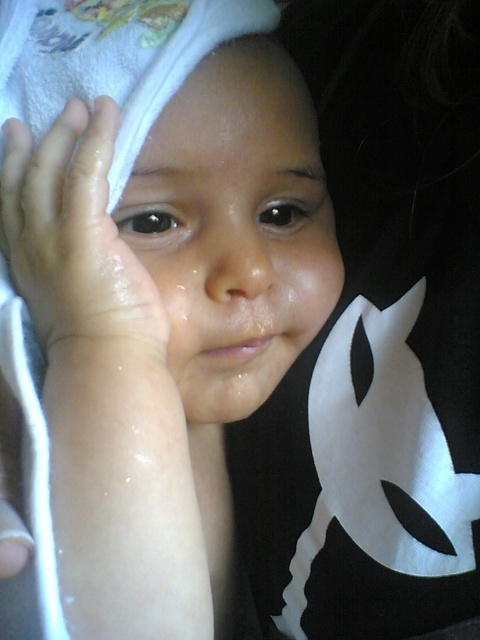
Question: Where is white towel at upper left located in relation to smooth skin face at center in the image?

Choices:
 (A) left
 (B) right

Answer: (A)

Question: Which object is the closest to the smooth skin face at center?

Choices:
 (A) slightly wet skin at upper left
 (B) white towel at upper left

Answer: (B)

Question: Can you confirm if white towel at upper left is positioned to the left of smooth skin face at center?

Choices:
 (A) yes
 (B) no

Answer: (A)

Question: Which point is closer to the camera?

Choices:
 (A) (158, 356)
 (B) (118, 518)
 (C) (251, 224)

Answer: (B)

Question: Does smooth skin face at center have a smaller size compared to slightly wet skin at upper left?

Choices:
 (A) no
 (B) yes

Answer: (A)

Question: Which object appears closest to the camera in this image?

Choices:
 (A) slightly wet skin at upper left
 (B) smooth skin face at center

Answer: (A)